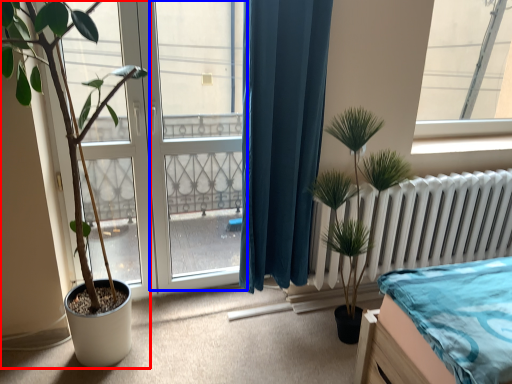
Question: Among these objects, which one is nearest to the camera, houseplant (highlighted by a red box) or screen door (highlighted by a blue box)?

Choices:
 (A) houseplant
 (B) screen door

Answer: (A)